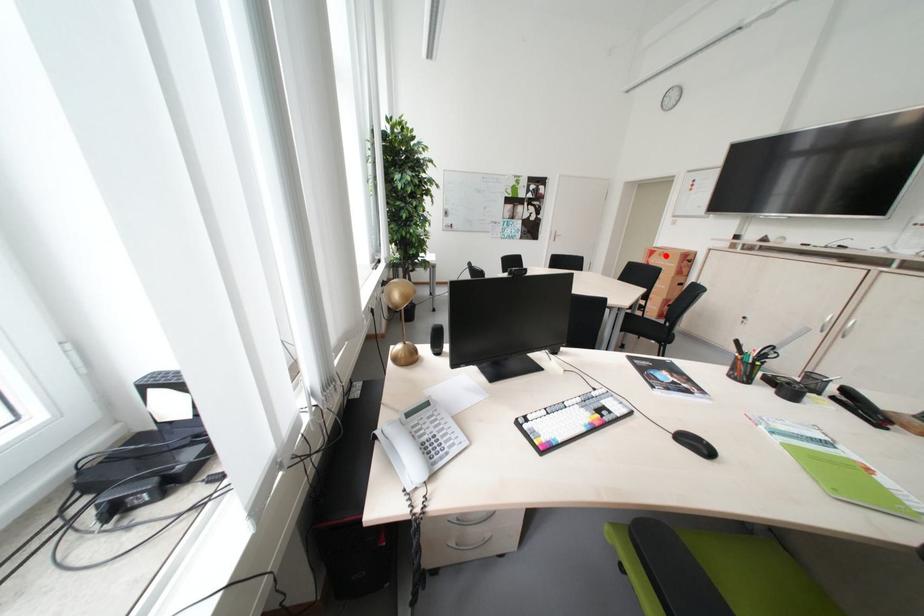
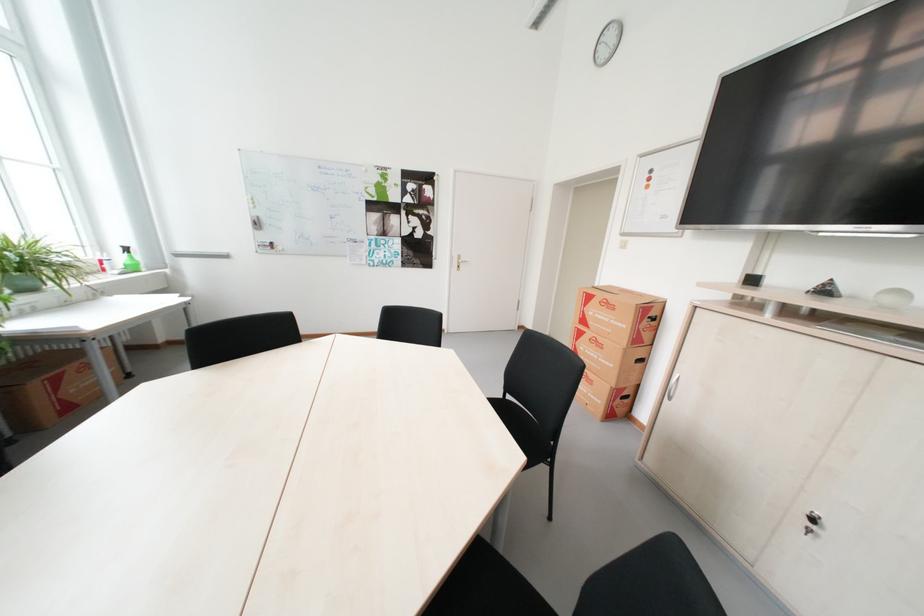
Find the pixel in the second image that matches the highlighted location in the first image.

(604, 302)